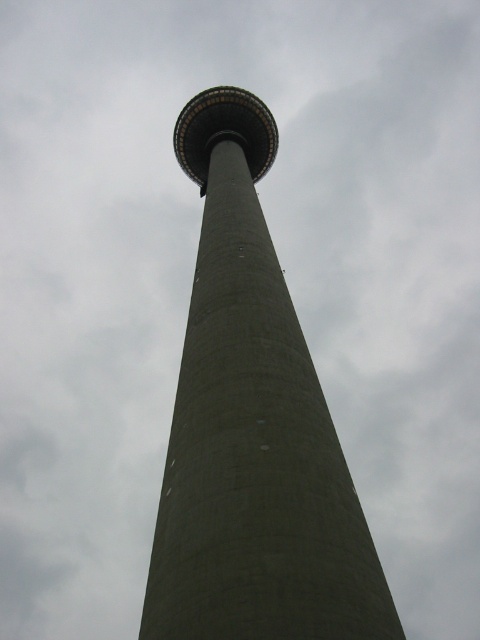
Can you confirm if gray concrete tower at center is bigger than concrete tower at center?

Correct, gray concrete tower at center is larger in size than concrete tower at center.

Which is more to the left, gray concrete tower at center or concrete tower at center?

concrete tower at center

At what (x,y) coordinates should I click in order to perform the action: click on gray concrete tower at center. Please return your answer as a coordinate pair (x, y). The width and height of the screenshot is (480, 640). Looking at the image, I should click on (252, 429).

Locate an element on the screen. This screenshot has height=640, width=480. gray concrete tower at center is located at coordinates (252, 429).